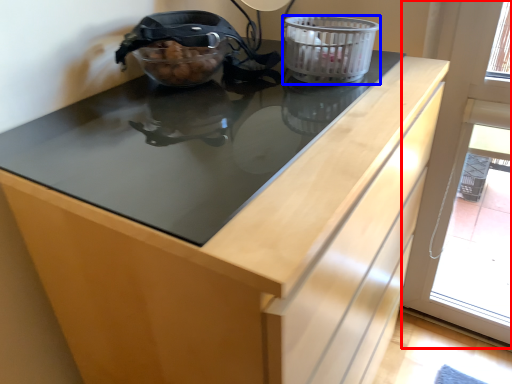
Question: Which object appears closest to the camera in this image, screen door (highlighted by a red box) or basket container (highlighted by a blue box)?

Choices:
 (A) screen door
 (B) basket container

Answer: (B)